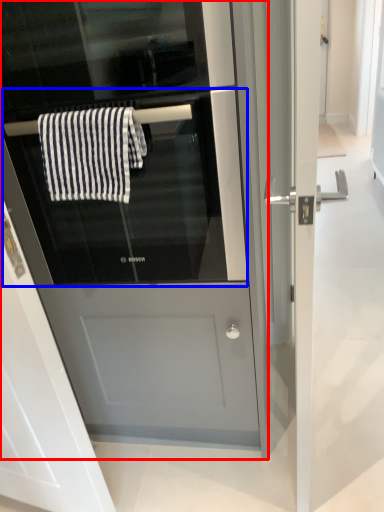
Question: Among these objects, which one is farthest to the camera, fridge (highlighted by a red box) or oven (highlighted by a blue box)?

Choices:
 (A) fridge
 (B) oven

Answer: (B)